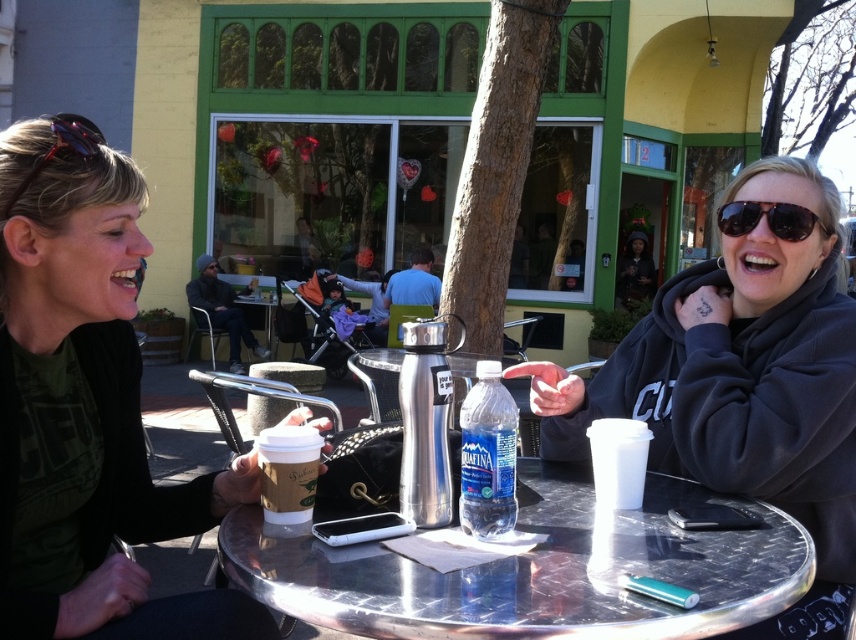
You are a customer at the outdoor cafe and want to place your order. The server points to the menu item located at point (742,385). What is the menu item they are indicating?

The point (742,385) corresponds to the matte black hoodie at center, so the server is indicating the matte black hoodie at center on the menu.

You are a fashion designer observing the two women at the outdoor cafe. You need to determine which of the two items, the matte black shirt at left or the matte black hoodie at center, is narrower in width. Which one is it?

The matte black shirt at left is narrower in width than the matte black hoodie at center.